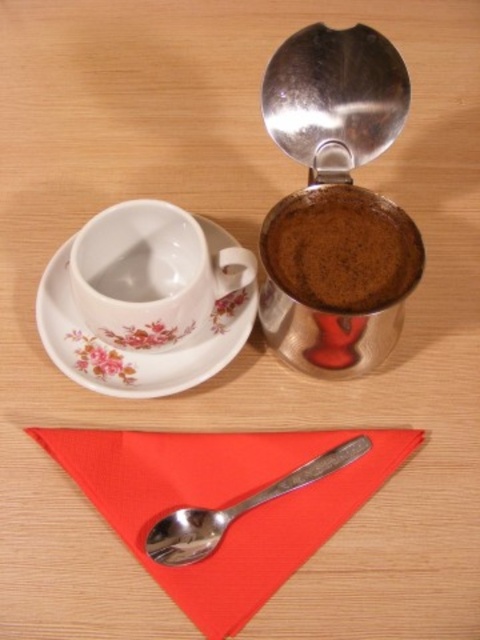
Who is more distant from viewer, [130,506] or [106,342]?

The point [106,342] is more distant.

Measure the distance between red fabric napkin at lower center and camera.

red fabric napkin at lower center and camera are 60.09 centimeters apart.

The image size is (480, 640). What are the coordinates of `red fabric napkin at lower center` in the screenshot? It's located at 224,502.

Is point (276, 234) closer to camera compared to point (169, 534)?

No, it is behind (169, 534).

I want to click on dark brown ground coffee at upper right, so click(x=342, y=250).

Image resolution: width=480 pixels, height=640 pixels. What are the coordinates of `dark brown ground coffee at upper right` in the screenshot? It's located at (342, 250).

Looking at this image, does shiny metallic coffee grinder at upper right have a lesser height compared to porcelain floral saucer at upper left?

Incorrect, shiny metallic coffee grinder at upper right's height does not fall short of porcelain floral saucer at upper left's.

From the picture: Which of these two, shiny metallic coffee grinder at upper right or porcelain floral saucer at upper left, stands taller?

shiny metallic coffee grinder at upper right is taller.

Which is in front, point (301, 232) or point (214, 364)?

Point (301, 232) is more forward.

This screenshot has height=640, width=480. Find the location of `shiny metallic coffee grinder at upper right`. shiny metallic coffee grinder at upper right is located at coordinates (336, 204).